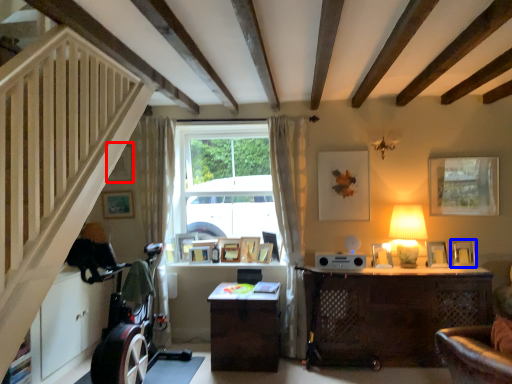
Question: Which point is closer to the camera, picture frame (highlighted by a red box) or picture frame (highlighted by a blue box)?

Choices:
 (A) picture frame
 (B) picture frame

Answer: (B)